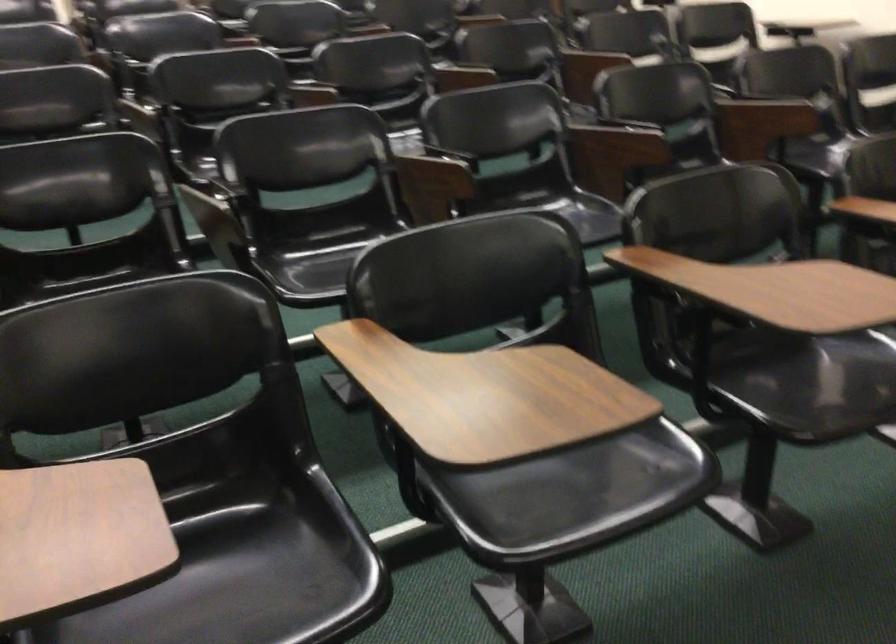
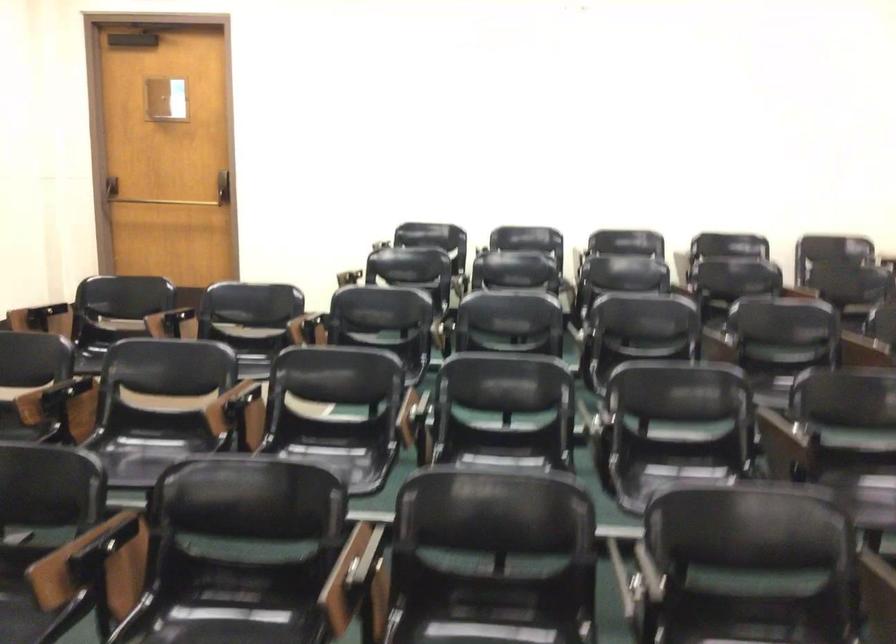
Question: The camera is either moving clockwise (left) or counter-clockwise (right) around the object. The first image is from the beginning of the video and the second image is from the end. Is the camera moving left or right when shooting the video?

Choices:
 (A) Left
 (B) Right

Answer: (B)